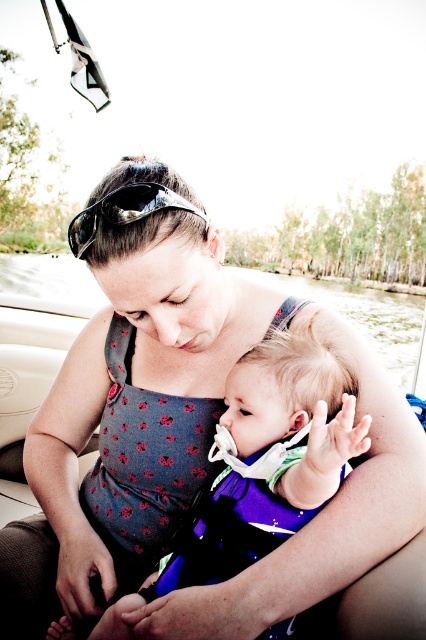
Does purple fabric baby at center have a lesser height compared to shiny black sunglasses at center?

Incorrect, purple fabric baby at center's height does not fall short of shiny black sunglasses at center's.

From the picture: Who is more forward, (330, 424) or (158, 189)?

Positioned in front is point (330, 424).

Identify the location of purple fabric baby at center. (267, 461).